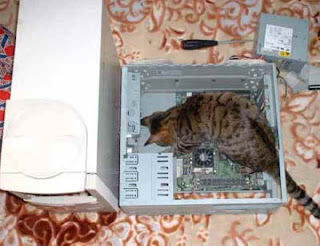
You are a GUI agent. You are given a task and a screenshot of the screen. Output one action in this format:
    pyautogui.click(x=<x>, y=<y>)
    Task: Click on the fan
    The width and height of the screenshot is (320, 246).
    Given the screenshot: What is the action you would take?
    pyautogui.click(x=203, y=160)